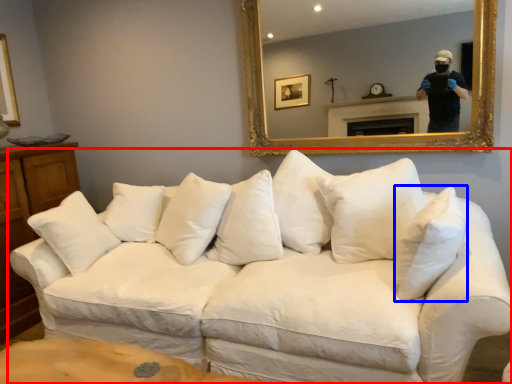
Question: Which object appears closest to the camera in this image, studio couch (highlighted by a red box) or pillow (highlighted by a blue box)?

Choices:
 (A) studio couch
 (B) pillow

Answer: (A)